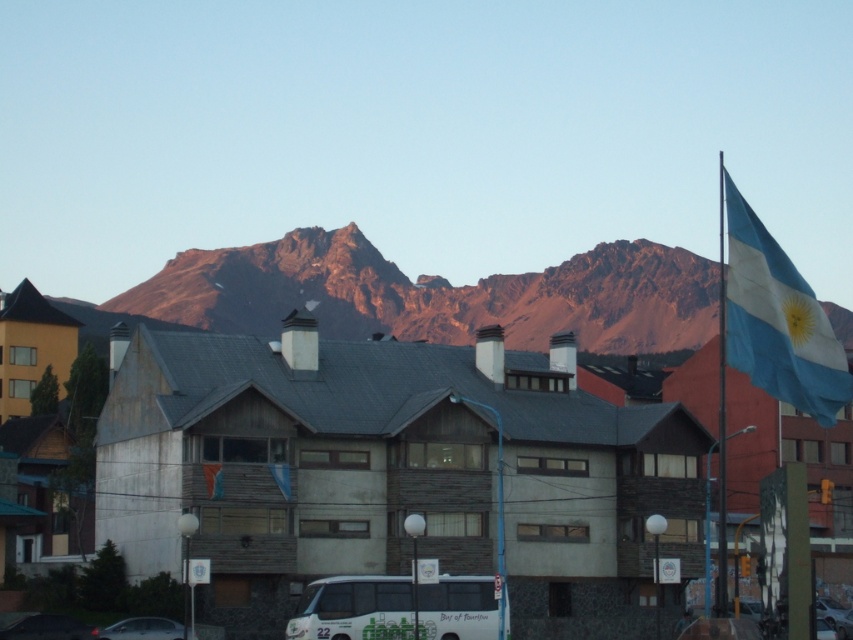
Question: Which point is closer to the camera taking this photo?

Choices:
 (A) (57, 636)
 (B) (433, 593)

Answer: (A)

Question: Is shiny black car at lower left closer to camera compared to matte black car at lower left?

Choices:
 (A) yes
 (B) no

Answer: (A)

Question: Considering the relative positions of white matte bus at lower center and matte black car at lower left in the image provided, where is white matte bus at lower center located with respect to matte black car at lower left?

Choices:
 (A) above
 (B) below

Answer: (A)

Question: In this image, where is shiny black car at lower left located relative to matte black car at lower left?

Choices:
 (A) above
 (B) below

Answer: (A)

Question: Which of the following is the farthest from the observer?

Choices:
 (A) (538, 454)
 (B) (401, 604)

Answer: (A)

Question: Among these points, which one is nearest to the camera?

Choices:
 (A) (405, 637)
 (B) (132, 627)
 (C) (82, 632)

Answer: (A)